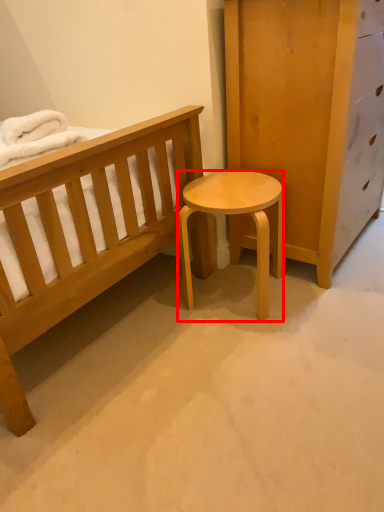
Question: Where is stool (annotated by the red box) located in relation to blanket in the image?

Choices:
 (A) left
 (B) right

Answer: (B)